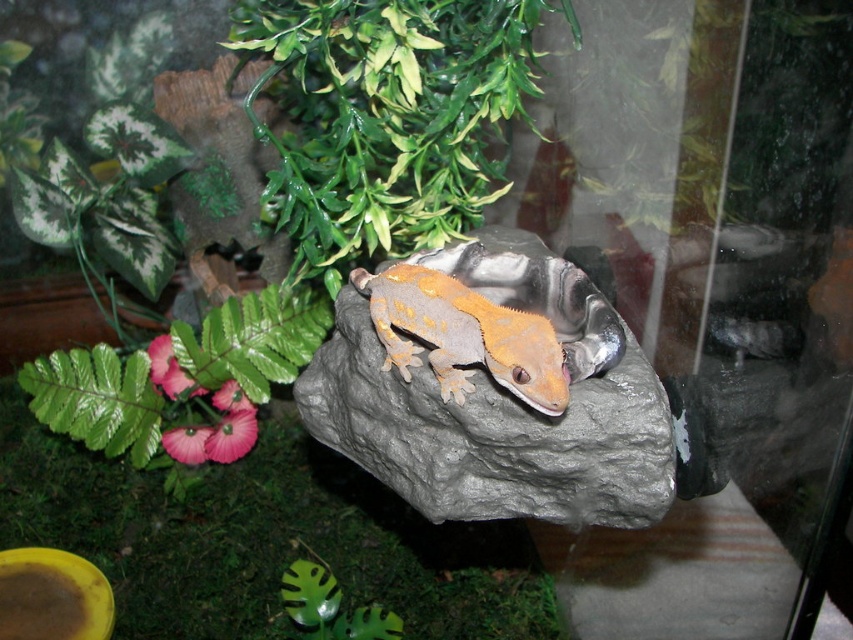
Is green leafy plant at upper center above gray matte rock at center?

Indeed, green leafy plant at upper center is positioned over gray matte rock at center.

Does green leafy plant at upper center have a larger size compared to gray matte rock at center?

Indeed, green leafy plant at upper center has a larger size compared to gray matte rock at center.

Between point (466, 163) and point (607, 348), which one is positioned in front?

Point (607, 348)

Identify the location of green leafy plant at upper center. (386, 116).

The width and height of the screenshot is (853, 640). Describe the element at coordinates (260, 540) in the screenshot. I see `green leafy plant at lower left` at that location.

Does green leafy plant at lower left have a greater height compared to gray matte rock at center?

No.

Who is more forward, (x=55, y=540) or (x=514, y=433)?

Point (x=514, y=433)

The width and height of the screenshot is (853, 640). I want to click on green leafy plant at lower left, so click(260, 540).

Can you confirm if green leafy plant at upper center is positioned below orange matte lizard at center?

No, green leafy plant at upper center is not below orange matte lizard at center.

Can you confirm if green leafy plant at upper center is positioned to the right of orange matte lizard at center?

No, green leafy plant at upper center is not to the right of orange matte lizard at center.

Who is more distant from viewer, (360, 109) or (514, 353)?

The point (360, 109) is more distant.

Where is `green leafy plant at upper center`? green leafy plant at upper center is located at coordinates [x=386, y=116].